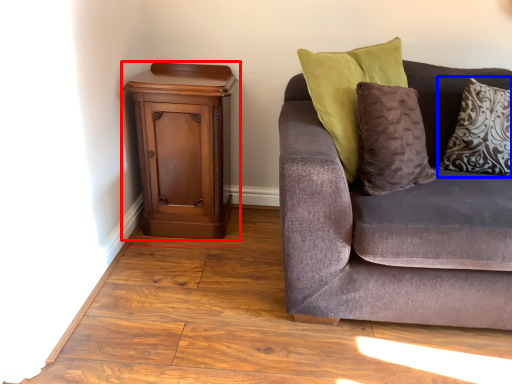
Question: Which point is closer to the camera, nightstand (highlighted by a red box) or pillow (highlighted by a blue box)?

Choices:
 (A) nightstand
 (B) pillow

Answer: (B)